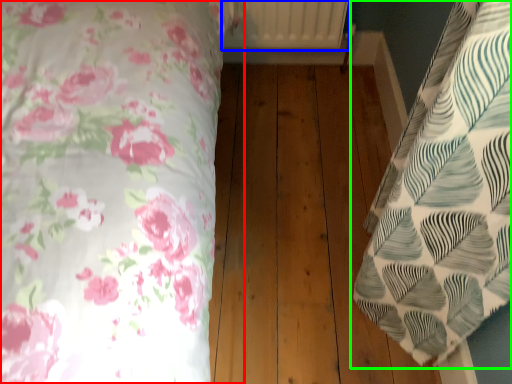
Question: Which is nearer to the bed (highlighted by a red box)? radiator (highlighted by a blue box) or bed (highlighted by a green box).

Choices:
 (A) radiator
 (B) bed

Answer: (B)